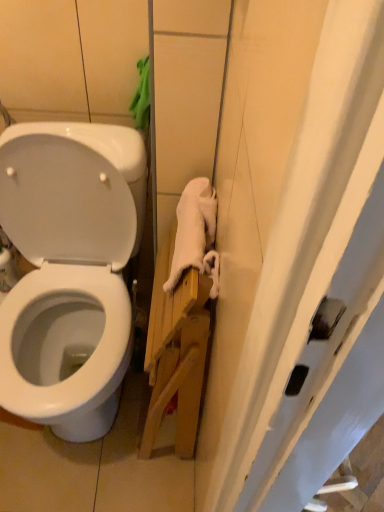
Question: Can you confirm if white soft towel at right is wider than white glossy toilet at left?

Choices:
 (A) no
 (B) yes

Answer: (A)

Question: Is white soft towel at right located outside white glossy toilet at left?

Choices:
 (A) no
 (B) yes

Answer: (B)

Question: Is white soft towel at right aimed at white glossy toilet at left?

Choices:
 (A) yes
 (B) no

Answer: (B)

Question: Is white soft towel at right in front of white glossy toilet at left?

Choices:
 (A) yes
 (B) no

Answer: (B)

Question: From the image's perspective, is white soft towel at right on top of white glossy toilet at left?

Choices:
 (A) no
 (B) yes

Answer: (B)

Question: From the image's perspective, does white soft towel at right appear lower than white glossy toilet at left?

Choices:
 (A) yes
 (B) no

Answer: (B)

Question: Can you confirm if white glossy toilet at left is positioned to the left of white glossy toilet at upper left?

Choices:
 (A) no
 (B) yes

Answer: (A)

Question: Would you say white glossy toilet at left contains white glossy toilet at upper left?

Choices:
 (A) no
 (B) yes

Answer: (A)

Question: Is white glossy toilet at left oriented away from white glossy toilet at upper left?

Choices:
 (A) no
 (B) yes

Answer: (B)

Question: Does white glossy toilet at left have a smaller size compared to white glossy toilet at upper left?

Choices:
 (A) yes
 (B) no

Answer: (B)

Question: Are white glossy toilet at left and white glossy toilet at upper left located far from each other?

Choices:
 (A) yes
 (B) no

Answer: (B)

Question: From the image's perspective, is white glossy toilet at left on white glossy toilet at upper left?

Choices:
 (A) yes
 (B) no

Answer: (B)

Question: From a real-world perspective, is white soft towel at right located higher than white glossy toilet at upper left?

Choices:
 (A) no
 (B) yes

Answer: (B)